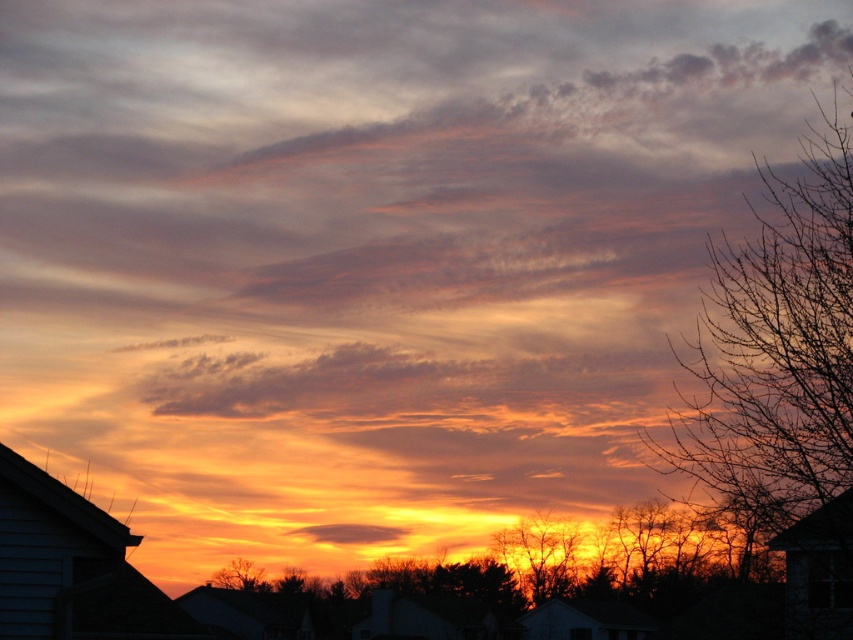
Question: Estimate the real-world distances between objects in this image. Which object is closer to the orange-brown textured tree at center?

Choices:
 (A) silvery branches at upper right
 (B) brown textured tree at lower center

Answer: (A)

Question: Is silvery branches at upper right positioned in front of matte orange cloud at center?

Choices:
 (A) yes
 (B) no

Answer: (A)

Question: Which object is the closest to the orange-brown textured tree at center?

Choices:
 (A) silvery branches at upper right
 (B) brown textured tree at lower center
 (C) matte orange cloud at center

Answer: (A)

Question: Which is nearer to the brown textured tree at lower center?

Choices:
 (A) silvery branches at upper right
 (B) orange-brown textured tree at center

Answer: (B)

Question: Is orange-brown textured tree at center to the left of brown textured tree at lower center from the viewer's perspective?

Choices:
 (A) yes
 (B) no

Answer: (B)

Question: Is orange-brown textured tree at center further to camera compared to brown textured tree at lower center?

Choices:
 (A) no
 (B) yes

Answer: (A)